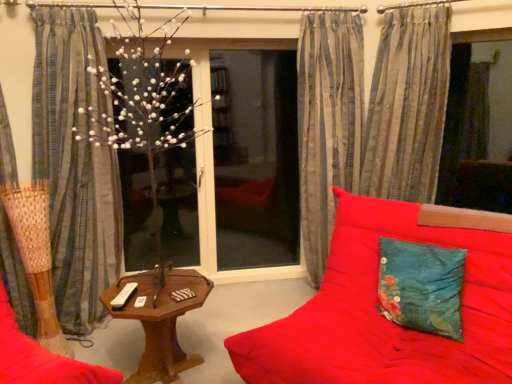
What is the approximate height of transparent glass screen door at center?

The height of transparent glass screen door at center is 5.53 feet.

You are a GUI agent. You are given a task and a screenshot of the screen. Output one action in this format:
    pyautogui.click(x=<x>, y=<y>)
    Task: Click on the woven bamboo curtain at left, the 4th curtain in the right-to-left sequence
    This screenshot has width=512, height=384.
    Given the screenshot: What is the action you would take?
    pyautogui.click(x=31, y=239)

I want to click on transparent glass screen door at center, so point(255,158).

Considering the positions of points (215, 206) and (378, 168), is point (215, 206) farther from camera compared to point (378, 168)?

Yes, it is.

Do you think white artificial tree at center, the first window screen positioned from the left, is within striped fabric curtain at right, which appears as the 1th curtain when viewed from the right, or outside of it?

white artificial tree at center, the first window screen positioned from the left, is located beyond the bounds of striped fabric curtain at right, which appears as the 1th curtain when viewed from the right.

Is white artificial tree at center, positioned as the 2th window screen in right-to-left order, facing away from striped fabric curtain at right, which is the 4th curtain from left to right?

No, white artificial tree at center, positioned as the 2th window screen in right-to-left order,'s orientation is not away from striped fabric curtain at right, which is the 4th curtain from left to right.

Is the depth of white artificial tree at center, positioned as the 2th window screen in right-to-left order, greater than that of striped fabric curtain at right, which is the 4th curtain from left to right?

Yes, it is behind striped fabric curtain at right, which is the 4th curtain from left to right.

From the image's perspective, is transparent glass window screen at right, the second window screen in the left-to-right sequence, on striped fabric curtain at right, which is the 4th curtain from left to right?

Actually, transparent glass window screen at right, the second window screen in the left-to-right sequence, appears below striped fabric curtain at right, which is the 4th curtain from left to right, in the image.

Which object is positioned more to the left, transparent glass window screen at right, marked as the first window screen in a right-to-left arrangement, or striped fabric curtain at right, which is the 4th curtain from left to right?

Positioned to the left is striped fabric curtain at right, which is the 4th curtain from left to right.

Could you measure the distance between transparent glass window screen at right, the second window screen in the left-to-right sequence, and striped fabric curtain at right, which appears as the 1th curtain when viewed from the right?

A distance of 66.78 centimeters exists between transparent glass window screen at right, the second window screen in the left-to-right sequence, and striped fabric curtain at right, which appears as the 1th curtain when viewed from the right.

Are transparent glass window screen at right, marked as the first window screen in a right-to-left arrangement, and striped fabric curtain at right, which appears as the 1th curtain when viewed from the right, far apart?

No, transparent glass window screen at right, marked as the first window screen in a right-to-left arrangement, is not far away from striped fabric curtain at right, which appears as the 1th curtain when viewed from the right.

Is white matte tree at center oriented towards striped fabric curtain at left, which is counted as the second curtain, starting from the left?

No, white matte tree at center is not turned towards striped fabric curtain at left, which is counted as the second curtain, starting from the left.

Considering the relative positions of white matte tree at center and striped fabric curtain at left, which is the 3th curtain from right to left, in the image provided, is white matte tree at center to the right of striped fabric curtain at left, which is the 3th curtain from right to left, from the viewer's perspective?

Correct, you'll find white matte tree at center to the right of striped fabric curtain at left, which is the 3th curtain from right to left.

Are white matte tree at center and striped fabric curtain at left, which is the 3th curtain from right to left, beside each other?

No.

In the image, there is a transparent glass screen door at center. Where is `table below it (from the image's perspective)`? Image resolution: width=512 pixels, height=384 pixels. table below it (from the image's perspective) is located at coordinates (160, 320).

Is woodenobject at center facing towards transparent glass screen door at center?

No, woodenobject at center is not aimed at transparent glass screen door at center.

In the scene shown: Considering the relative sizes of woodenobject at center and transparent glass screen door at center in the image provided, is woodenobject at center wider than transparent glass screen door at center?

Indeed, woodenobject at center has a greater width compared to transparent glass screen door at center.

Would you say transparent glass screen door at center is part of woodenobject at center's contents?

No.

Is striped fabric curtain at right, which is the 4th curtain from left to right, far from transparent glass screen door at center?

Absolutely, striped fabric curtain at right, which is the 4th curtain from left to right, is distant from transparent glass screen door at center.

From the image's perspective, which object appears higher, striped fabric curtain at right, which is the 4th curtain from left to right, or transparent glass screen door at center?

striped fabric curtain at right, which is the 4th curtain from left to right.

Based on the photo, is striped fabric curtain at right, which is the 4th curtain from left to right, aimed at transparent glass screen door at center?

No, striped fabric curtain at right, which is the 4th curtain from left to right, is not turned towards transparent glass screen door at center.

Measure the distance from striped fabric curtain at right, which is the 4th curtain from left to right, to transparent glass screen door at center.

The distance of striped fabric curtain at right, which is the 4th curtain from left to right, from transparent glass screen door at center is 1.29 meters.

Is red fabric couch at center positioned with its back to woodenobject at center?

No, red fabric couch at center is not facing away from woodenobject at center.

Is red fabric couch at center closer to camera compared to woodenobject at center?

Yes, it is.

Between woodenobject at center and striped fabric curtain at right, which is the 4th curtain from left to right, which one has smaller width?

striped fabric curtain at right, which is the 4th curtain from left to right.

Considering the points (138, 369) and (390, 120), which point is in front, point (138, 369) or point (390, 120)?

The point (138, 369) is closer.

Between woodenobject at center and striped fabric curtain at right, which is the 4th curtain from left to right, which one appears on the left side from the viewer's perspective?

From the viewer's perspective, woodenobject at center appears more on the left side.

Where is `the 2nd curtain positioned above the white artificial tree at center, positioned as the 2th window screen in right-to-left order (from the image's perspective)`? Image resolution: width=512 pixels, height=384 pixels. the 2nd curtain positioned above the white artificial tree at center, positioned as the 2th window screen in right-to-left order (from the image's perspective) is located at coordinates (407, 105).

Which curtain is the 1st one when counting from the left side of the transparent glass window screen at right, the second window screen in the left-to-right sequence? Please provide its 2D coordinates.

[(407, 105)]

When comparing their distances from striped fabric curtain at right, which is the 4th curtain from left to right, does red fabric couch at center or white matte tree at center seem closer?

red fabric couch at center.

Which object lies further to the anchor point teal fabric cushion at right, transparent glass screen door at center or transparent glass window screen at right, the second window screen in the left-to-right sequence?

The object further to teal fabric cushion at right is transparent glass screen door at center.

Considering their positions, is white artificial tree at center, positioned as the 2th window screen in right-to-left order, positioned closer to transparent glass screen door at center than striped fabric curtain at right, which appears as the 1th curtain when viewed from the right?

Among the two, white artificial tree at center, positioned as the 2th window screen in right-to-left order, is located nearer to transparent glass screen door at center.

When comparing their distances from white matte tree at center, does transparent glass screen door at center or woven bamboo curtain at left, the 4th curtain in the right-to-left sequence, seem further?

transparent glass screen door at center is positioned further to the anchor white matte tree at center.

From the image, which object appears to be nearer to teal fabric cushion at right, silky striped curtain at center, which appears as the third curtain when viewed from the left, or transparent glass window screen at right, marked as the first window screen in a right-to-left arrangement?

silky striped curtain at center, which appears as the third curtain when viewed from the left.

Estimate the real-world distances between objects in this image. Which object is further from transparent glass screen door at center, striped fabric curtain at right, which is the 4th curtain from left to right, or woodenobject at center?

Among the two, woodenobject at center is located further to transparent glass screen door at center.

When comparing their distances from woodenobject at center, does woven bamboo curtain at left, which is the first curtain from left to right, or striped fabric curtain at right, which appears as the 1th curtain when viewed from the right, seem closer?

Among the two, woven bamboo curtain at left, which is the first curtain from left to right, is located nearer to woodenobject at center.

Looking at the image, which one is located further to transparent glass screen door at center, woven bamboo curtain at left, which is the first curtain from left to right, or striped fabric curtain at left, which is the 3th curtain from right to left?

Among the two, woven bamboo curtain at left, which is the first curtain from left to right, is located further to transparent glass screen door at center.

You are a GUI agent. You are given a task and a screenshot of the screen. Output one action in this format:
    pyautogui.click(x=<x>, y=<y>)
    Task: Click on the screen door between striped fabric curtain at left, which is the 3th curtain from right to left, and teal fabric cushion at right, in the horizontal direction
    The height and width of the screenshot is (384, 512).
    Given the screenshot: What is the action you would take?
    pyautogui.click(x=255, y=158)

Locate an element on the screen. table between red fabric couch at center and white matte tree at center along the z-axis is located at coordinates (160, 320).

You are a GUI agent. You are given a task and a screenshot of the screen. Output one action in this format:
    pyautogui.click(x=<x>, y=<y>)
    Task: Click on the studio couch between striped fabric curtain at left, which is counted as the second curtain, starting from the left, and striped fabric curtain at right, which appears as the 1th curtain when viewed from the right
    
    Given the screenshot: What is the action you would take?
    pyautogui.click(x=248, y=353)

Where is `pillow that lies between striped fabric curtain at right, which is the 4th curtain from left to right, and red fabric couch at center from top to bottom`? This screenshot has width=512, height=384. pillow that lies between striped fabric curtain at right, which is the 4th curtain from left to right, and red fabric couch at center from top to bottom is located at coordinates (421, 287).